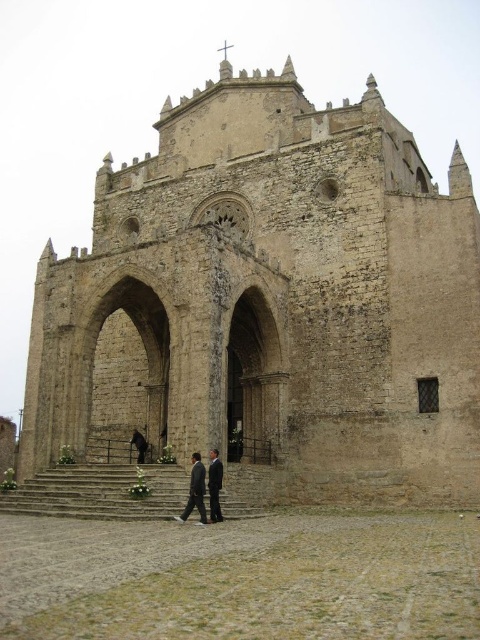
You are standing in front of the historic stone church and see the stone steps at center and the dark gray suit at center. Which object is located to the left of the other?

The stone steps at center is positioned on the left side of dark gray suit at center.